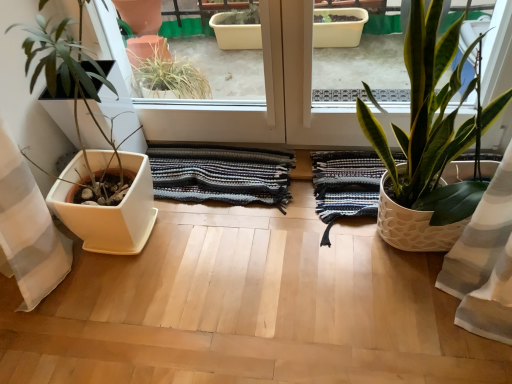
How much space does white textured pot at right, which is counted as the first houseplant, starting from the right, occupy horizontally?

white textured pot at right, which is counted as the first houseplant, starting from the right, is 12.12 inches in width.

The height and width of the screenshot is (384, 512). Describe the element at coordinates (221, 174) in the screenshot. I see `striped cotton rug at center, the 2th bath towel from the right` at that location.

Locate an element on the screen. white matte planter at left, placed as the second houseplant when sorted from right to left is located at coordinates (110, 167).

Can you confirm if white textured bath towel at right, which is the second bath towel in left-to-right order, is thinner than white textured pot at right, positioned as the 2th houseplant in left-to-right order?

Incorrect, the width of white textured bath towel at right, which is the second bath towel in left-to-right order, is not less than that of white textured pot at right, positioned as the 2th houseplant in left-to-right order.

Considering the relative positions of white textured bath towel at right, which is the second bath towel in left-to-right order, and white textured pot at right, positioned as the 2th houseplant in left-to-right order, in the image provided, is white textured bath towel at right, which is the second bath towel in left-to-right order, to the right of white textured pot at right, positioned as the 2th houseplant in left-to-right order, from the viewer's perspective?

No, white textured bath towel at right, which is the second bath towel in left-to-right order, is not to the right of white textured pot at right, positioned as the 2th houseplant in left-to-right order.

Is white textured bath towel at right, the first bath towel in the right-to-left sequence, not inside white textured pot at right, positioned as the 2th houseplant in left-to-right order?

Actually, white textured bath towel at right, the first bath towel in the right-to-left sequence, is within white textured pot at right, positioned as the 2th houseplant in left-to-right order.

How different are the orientations of white textured bath towel at right, which is the second bath towel in left-to-right order, and white textured pot at right, which is counted as the first houseplant, starting from the right, in degrees?

white textured bath towel at right, which is the second bath towel in left-to-right order, and white textured pot at right, which is counted as the first houseplant, starting from the right, are facing 1.31 degrees away from each other.

Which is behind, point (104, 9) or point (348, 213)?

The point (348, 213) is farther.

Which of these two, white matte planter at left, placed as the second houseplant when sorted from right to left, or white textured bath towel at right, which is the second bath towel in left-to-right order, is wider?

With larger width is white matte planter at left, placed as the second houseplant when sorted from right to left.

From a real-world perspective, is white matte planter at left, placed as the second houseplant when sorted from right to left, located beneath white textured bath towel at right, the first bath towel in the right-to-left sequence?

No, from a real-world perspective, white matte planter at left, placed as the second houseplant when sorted from right to left, is not under white textured bath towel at right, the first bath towel in the right-to-left sequence.

In terms of width, does striped cotton rug at center, the 1th bath towel viewed from the left, look wider or thinner when compared to white textured pot at right, positioned as the 2th houseplant in left-to-right order?

In the image, striped cotton rug at center, the 1th bath towel viewed from the left, appears to be more narrow than white textured pot at right, positioned as the 2th houseplant in left-to-right order.

Is striped cotton rug at center, the 1th bath towel viewed from the left, with white textured pot at right, which is counted as the first houseplant, starting from the right?

No.

Locate an element on the screen. This screenshot has height=384, width=512. houseplant on the right of striped cotton rug at center, the 2th bath towel from the right is located at coordinates click(x=428, y=143).

What's the angular difference between striped cotton rug at center, the 2th bath towel from the right, and white textured pot at right, positioned as the 2th houseplant in left-to-right order,'s facing directions?

They differ by 2.67 degrees in their facing directions.

Identify the location of the 1st bath towel positioned below the white matte planter at left, placed as the second houseplant when sorted from right to left (from a real-world perspective). This screenshot has width=512, height=384. coord(221,174).

From a real-world perspective, who is located lower, striped cotton rug at center, the 2th bath towel from the right, or white matte planter at left, placed as the second houseplant when sorted from right to left?

striped cotton rug at center, the 2th bath towel from the right, from a real-world perspective.

From the image's perspective, between striped cotton rug at center, the 2th bath towel from the right, and white matte planter at left, arranged as the 1th houseplant when viewed from the left, who is located below?

striped cotton rug at center, the 2th bath towel from the right, appears lower in the image.

Which object is thinner, striped cotton rug at center, the 1th bath towel viewed from the left, or white matte planter at left, placed as the second houseplant when sorted from right to left?

striped cotton rug at center, the 1th bath towel viewed from the left, is thinner.

Is white matte planter at left, placed as the second houseplant when sorted from right to left, not close to white textured pot at right, which is counted as the first houseplant, starting from the right?

No, white matte planter at left, placed as the second houseplant when sorted from right to left, is in close proximity to white textured pot at right, which is counted as the first houseplant, starting from the right.

Is white matte planter at left, arranged as the 1th houseplant when viewed from the left, thinner than white textured pot at right, which is counted as the first houseplant, starting from the right?

A: No, white matte planter at left, arranged as the 1th houseplant when viewed from the left, is not thinner than white textured pot at right, which is counted as the first houseplant, starting from the right.

From a real-world perspective, is white matte planter at left, placed as the second houseplant when sorted from right to left, under white textured pot at right, which is counted as the first houseplant, starting from the right?

No.

Is white textured pot at right, which is counted as the first houseplant, starting from the right, at the back of white matte planter at left, placed as the second houseplant when sorted from right to left?

white matte planter at left, placed as the second houseplant when sorted from right to left, is not turned away from white textured pot at right, which is counted as the first houseplant, starting from the right.

Considering the positions of objects white matte planter at left, arranged as the 1th houseplant when viewed from the left, and striped cotton rug at center, the 2th bath towel from the right, in the image provided, who is behind, white matte planter at left, arranged as the 1th houseplant when viewed from the left, or striped cotton rug at center, the 2th bath towel from the right,?

striped cotton rug at center, the 2th bath towel from the right.

Which is in front, point (88, 144) or point (166, 172)?

Positioned in front is point (88, 144).

Is white matte planter at left, arranged as the 1th houseplant when viewed from the left, positioned with its back to striped cotton rug at center, the 2th bath towel from the right?

white matte planter at left, arranged as the 1th houseplant when viewed from the left, does not have its back to striped cotton rug at center, the 2th bath towel from the right.

Is white matte planter at left, placed as the second houseplant when sorted from right to left, touching striped cotton rug at center, the 1th bath towel viewed from the left?

They are not placed beside each other.

From a real-world perspective, is striped cotton rug at center, the 1th bath towel viewed from the left, on top of white textured bath towel at right, the first bath towel in the right-to-left sequence?

Yes, from a real-world perspective, striped cotton rug at center, the 1th bath towel viewed from the left, is on top of white textured bath towel at right, the first bath towel in the right-to-left sequence.

Is striped cotton rug at center, the 2th bath towel from the right, shorter than white textured bath towel at right, the first bath towel in the right-to-left sequence?

In fact, striped cotton rug at center, the 2th bath towel from the right, may be taller than white textured bath towel at right, the first bath towel in the right-to-left sequence.

Identify the location of bath towel that is in front of the striped cotton rug at center, the 1th bath towel viewed from the left. click(345, 185).

How far apart are striped cotton rug at center, the 2th bath towel from the right, and white textured bath towel at right, which is the second bath towel in left-to-right order?

A distance of 10.17 inches exists between striped cotton rug at center, the 2th bath towel from the right, and white textured bath towel at right, which is the second bath towel in left-to-right order.

In order to click on houseplant on the right of white textured bath towel at right, which is the second bath towel in left-to-right order in this screenshot , I will do `click(428, 143)`.

Where is `the 2nd bath towel below the white matte planter at left, arranged as the 1th houseplant when viewed from the left (from a real-world perspective)`? This screenshot has height=384, width=512. the 2nd bath towel below the white matte planter at left, arranged as the 1th houseplant when viewed from the left (from a real-world perspective) is located at coordinates (345, 185).

Based on their spatial positions, is white textured bath towel at right, the first bath towel in the right-to-left sequence, or striped cotton rug at center, the 1th bath towel viewed from the left, further from white matte planter at left, arranged as the 1th houseplant when viewed from the left?

Among the two, white textured bath towel at right, the first bath towel in the right-to-left sequence, is located further to white matte planter at left, arranged as the 1th houseplant when viewed from the left.

Estimate the real-world distances between objects in this image. Which object is further from white textured pot at right, positioned as the 2th houseplant in left-to-right order, white textured bath towel at right, which is the second bath towel in left-to-right order, or white matte planter at left, placed as the second houseplant when sorted from right to left?

The object further to white textured pot at right, positioned as the 2th houseplant in left-to-right order, is white matte planter at left, placed as the second houseplant when sorted from right to left.

Estimate the real-world distances between objects in this image. Which object is closer to white textured pot at right, positioned as the 2th houseplant in left-to-right order, white textured bath towel at right, which is the second bath towel in left-to-right order, or striped cotton rug at center, the 1th bath towel viewed from the left?

Among the two, white textured bath towel at right, which is the second bath towel in left-to-right order, is located nearer to white textured pot at right, positioned as the 2th houseplant in left-to-right order.

Which object lies further to the anchor point white matte planter at left, arranged as the 1th houseplant when viewed from the left, white textured bath towel at right, which is the second bath towel in left-to-right order, or white textured pot at right, which is counted as the first houseplant, starting from the right?

Among the two, white textured pot at right, which is counted as the first houseplant, starting from the right, is located further to white matte planter at left, arranged as the 1th houseplant when viewed from the left.

Considering their positions, is white textured pot at right, positioned as the 2th houseplant in left-to-right order, positioned further to white textured bath towel at right, the first bath towel in the right-to-left sequence, than striped cotton rug at center, the 2th bath towel from the right?

The object further to white textured bath towel at right, the first bath towel in the right-to-left sequence, is white textured pot at right, positioned as the 2th houseplant in left-to-right order.

Based on their spatial positions, is white textured bath towel at right, which is the second bath towel in left-to-right order, or white textured pot at right, positioned as the 2th houseplant in left-to-right order, closer to striped cotton rug at center, the 2th bath towel from the right?

white textured bath towel at right, which is the second bath towel in left-to-right order, lies closer to striped cotton rug at center, the 2th bath towel from the right, than the other object.

Looking at this image, based on their spatial positions, is white matte planter at left, arranged as the 1th houseplant when viewed from the left, or white textured bath towel at right, the first bath towel in the right-to-left sequence, closer to striped cotton rug at center, the 1th bath towel viewed from the left?

white textured bath towel at right, the first bath towel in the right-to-left sequence, is closer to striped cotton rug at center, the 1th bath towel viewed from the left.

Looking at the image, which one is located closer to white matte planter at left, arranged as the 1th houseplant when viewed from the left, white textured pot at right, which is counted as the first houseplant, starting from the right, or white textured bath towel at right, the first bath towel in the right-to-left sequence?

white textured bath towel at right, the first bath towel in the right-to-left sequence, is closer to white matte planter at left, arranged as the 1th houseplant when viewed from the left.

Identify the location of bath towel located between white textured pot at right, which is counted as the first houseplant, starting from the right, and striped cotton rug at center, the 2th bath towel from the right, in the depth direction. [345, 185].

The height and width of the screenshot is (384, 512). Find the location of `bath towel located between white matte planter at left, arranged as the 1th houseplant when viewed from the left, and striped cotton rug at center, the 2th bath towel from the right, in the depth direction`. bath towel located between white matte planter at left, arranged as the 1th houseplant when viewed from the left, and striped cotton rug at center, the 2th bath towel from the right, in the depth direction is located at coordinates (345, 185).